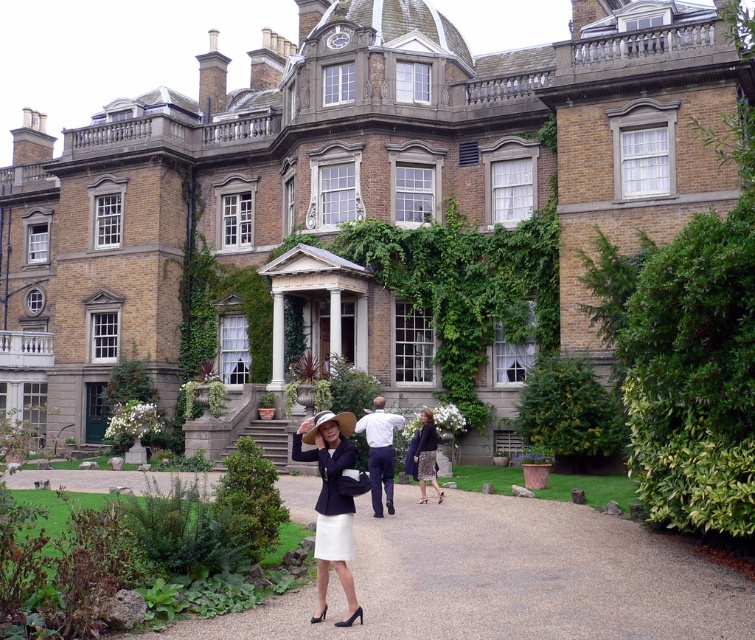
Question: Is white gravel path at center positioned behind dark gray skirt at center?

Choices:
 (A) no
 (B) yes

Answer: (A)

Question: Which object appears farthest from the camera in this image?

Choices:
 (A) matte black blazer at center
 (B) white cotton shirt at center
 (C) brown brick mansion at center

Answer: (C)

Question: Can you confirm if brown brick mansion at center is bigger than dark gray skirt at center?

Choices:
 (A) yes
 (B) no

Answer: (A)

Question: Which object appears farthest from the camera in this image?

Choices:
 (A) matte black blazer at center
 (B) dark gray skirt at center
 (C) brown brick mansion at center

Answer: (C)

Question: Does matte black blazer at center appear over white cotton shirt at center?

Choices:
 (A) yes
 (B) no

Answer: (B)

Question: Which object is farther from the camera taking this photo?

Choices:
 (A) brown brick mansion at center
 (B) white cotton shirt at center

Answer: (A)